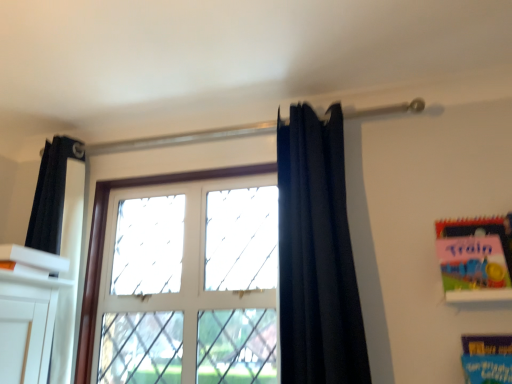
Identify the location of matte pink paper at upper right, positioned as the 1th paperback book in top-to-bottom order. (475, 258).

Describe the element at coordinates (487, 358) in the screenshot. This screenshot has height=384, width=512. I see `blue cardboard book at lower right, the second paperback book in the top-to-bottom sequence` at that location.

You are a GUI agent. You are given a task and a screenshot of the screen. Output one action in this format:
    pyautogui.click(x=<x>, y=<y>)
    Task: Click on the white glass window at center
    This screenshot has height=384, width=512.
    Given the screenshot: What is the action you would take?
    pyautogui.click(x=104, y=242)

Is dark blue fabric at center facing away from blue cardboard book at lower right, the second paperback book in the top-to-bottom sequence?

No.

Between dark blue fabric at center and blue cardboard book at lower right, marked as the first paperback book in a bottom-to-top arrangement, which one has larger size?

dark blue fabric at center is bigger.

Is dark blue fabric at center not close to blue cardboard book at lower right, marked as the first paperback book in a bottom-to-top arrangement?

dark blue fabric at center is near blue cardboard book at lower right, marked as the first paperback book in a bottom-to-top arrangement, not far away.

Considering the relative sizes of dark blue fabric at center and blue cardboard book at lower right, the second paperback book in the top-to-bottom sequence, in the image provided, is dark blue fabric at center taller than blue cardboard book at lower right, the second paperback book in the top-to-bottom sequence,?

Correct, dark blue fabric at center is much taller as blue cardboard book at lower right, the second paperback book in the top-to-bottom sequence.

From a real-world perspective, which is physically above, blue cardboard book at lower right, the second paperback book in the top-to-bottom sequence, or matte pink paper at upper right, the 2th paperback book when ordered from bottom to top?

matte pink paper at upper right, the 2th paperback book when ordered from bottom to top, from a real-world perspective.

What are the coordinates of `paperback book located above the blue cardboard book at lower right, the second paperback book in the top-to-bottom sequence (from a real-world perspective)` in the screenshot? It's located at (475, 258).

Is blue cardboard book at lower right, the second paperback book in the top-to-bottom sequence, wider or thinner than matte pink paper at upper right, the 2th paperback book when ordered from bottom to top?

In the image, blue cardboard book at lower right, the second paperback book in the top-to-bottom sequence, appears to be more narrow than matte pink paper at upper right, the 2th paperback book when ordered from bottom to top.

Is blue cardboard book at lower right, the second paperback book in the top-to-bottom sequence, to the right of matte pink paper at upper right, the 2th paperback book when ordered from bottom to top, from the viewer's perspective?

Incorrect, blue cardboard book at lower right, the second paperback book in the top-to-bottom sequence, is not on the right side of matte pink paper at upper right, the 2th paperback book when ordered from bottom to top.

In the image, is blue cardboard book at lower right, marked as the first paperback book in a bottom-to-top arrangement, on the left side or the right side of white glass window at center?

Based on their positions, blue cardboard book at lower right, marked as the first paperback book in a bottom-to-top arrangement, is located to the right of white glass window at center.

Is blue cardboard book at lower right, marked as the first paperback book in a bottom-to-top arrangement, shorter than white glass window at center?

Yes.

Is blue cardboard book at lower right, marked as the first paperback book in a bottom-to-top arrangement, touching white glass window at center?

No.

Find the location of `window that appears behind the blue cardboard book at lower right, the second paperback book in the top-to-bottom sequence`. window that appears behind the blue cardboard book at lower right, the second paperback book in the top-to-bottom sequence is located at coordinates (104, 242).

Is there a large distance between matte pink paper at upper right, the 2th paperback book when ordered from bottom to top, and blue cardboard book at lower right, the second paperback book in the top-to-bottom sequence?

No, there isn't a large distance between matte pink paper at upper right, the 2th paperback book when ordered from bottom to top, and blue cardboard book at lower right, the second paperback book in the top-to-bottom sequence.

Between point (439, 229) and point (502, 375), which one is positioned in front?

Positioned in front is point (502, 375).

Who is taller, matte pink paper at upper right, the 2th paperback book when ordered from bottom to top, or blue cardboard book at lower right, the second paperback book in the top-to-bottom sequence?

With more height is matte pink paper at upper right, the 2th paperback book when ordered from bottom to top.

Is matte pink paper at upper right, positioned as the 1th paperback book in top-to-bottom order, facing towards blue cardboard book at lower right, the second paperback book in the top-to-bottom sequence?

No, matte pink paper at upper right, positioned as the 1th paperback book in top-to-bottom order, does not turn towards blue cardboard book at lower right, the second paperback book in the top-to-bottom sequence.

Between white glass window at center and blue cardboard book at lower right, the second paperback book in the top-to-bottom sequence, which one has more height?

white glass window at center.

How different are the orientations of white glass window at center and blue cardboard book at lower right, the second paperback book in the top-to-bottom sequence, in degrees?

white glass window at center and blue cardboard book at lower right, the second paperback book in the top-to-bottom sequence, are facing 0.839 degrees away from each other.

Is white glass window at center next to blue cardboard book at lower right, the second paperback book in the top-to-bottom sequence?

They are not placed beside each other.

Based on the photo, from a real-world perspective, is dark blue fabric at center above or below white glass window at center?

dark blue fabric at center is situated higher than white glass window at center in the real world.

From the picture: From the image's perspective, which is above, dark blue fabric at center or white glass window at center?

Answer: dark blue fabric at center is shown above in the image.

Could you tell me if dark blue fabric at center is turned towards white glass window at center?

No, dark blue fabric at center is not turned towards white glass window at center.

From the picture: Which point is more distant from viewer, (286, 287) or (150, 184)?

Point (150, 184)

Does blue cardboard book at lower right, the second paperback book in the top-to-bottom sequence, have a lesser height compared to dark blue fabric at center?

Yes, blue cardboard book at lower right, the second paperback book in the top-to-bottom sequence, is shorter than dark blue fabric at center.

Between blue cardboard book at lower right, the second paperback book in the top-to-bottom sequence, and dark blue fabric at center, which one has larger width?

dark blue fabric at center.

Is blue cardboard book at lower right, the second paperback book in the top-to-bottom sequence, touching dark blue fabric at center?

blue cardboard book at lower right, the second paperback book in the top-to-bottom sequence, is not next to dark blue fabric at center, and they're not touching.

From a real-world perspective, is blue cardboard book at lower right, the second paperback book in the top-to-bottom sequence, on dark blue fabric at center?

Incorrect, from a real-world perspective, blue cardboard book at lower right, the second paperback book in the top-to-bottom sequence, is lower than dark blue fabric at center.

From the image's perspective, starting from the dark blue fabric at center, which paperback book is the 2nd one below? Please provide its 2D coordinates.

[(487, 358)]

Where is `paperback book on the right of blue cardboard book at lower right, marked as the first paperback book in a bottom-to-top arrangement`? Image resolution: width=512 pixels, height=384 pixels. paperback book on the right of blue cardboard book at lower right, marked as the first paperback book in a bottom-to-top arrangement is located at coordinates (475, 258).

Looking at the image, which one is located closer to white glass window at center, matte pink paper at upper right, the 2th paperback book when ordered from bottom to top, or dark blue fabric at center?

dark blue fabric at center is positioned closer to the anchor white glass window at center.

Looking at the image, which one is located further to dark blue fabric at center, matte pink paper at upper right, positioned as the 1th paperback book in top-to-bottom order, or white glass window at center?

white glass window at center is positioned further to the anchor dark blue fabric at center.

Which object lies further to the anchor point matte pink paper at upper right, the 2th paperback book when ordered from bottom to top, blue cardboard book at lower right, marked as the first paperback book in a bottom-to-top arrangement, or white glass window at center?

white glass window at center lies further to matte pink paper at upper right, the 2th paperback book when ordered from bottom to top, than the other object.

Looking at the image, which one is located further to dark blue fabric at center, matte pink paper at upper right, positioned as the 1th paperback book in top-to-bottom order, or blue cardboard book at lower right, the second paperback book in the top-to-bottom sequence?

blue cardboard book at lower right, the second paperback book in the top-to-bottom sequence, lies further to dark blue fabric at center than the other object.

From the image, which object appears to be farther from blue cardboard book at lower right, the second paperback book in the top-to-bottom sequence, white glass window at center or dark blue fabric at center?

white glass window at center.

When comparing their distances from white glass window at center, does blue cardboard book at lower right, marked as the first paperback book in a bottom-to-top arrangement, or matte pink paper at upper right, the 2th paperback book when ordered from bottom to top, seem closer?

matte pink paper at upper right, the 2th paperback book when ordered from bottom to top.

Based on their spatial positions, is matte pink paper at upper right, the 2th paperback book when ordered from bottom to top, or white glass window at center further from blue cardboard book at lower right, marked as the first paperback book in a bottom-to-top arrangement?

Based on the image, white glass window at center appears to be further to blue cardboard book at lower right, marked as the first paperback book in a bottom-to-top arrangement.

Based on their spatial positions, is dark blue fabric at center or white glass window at center further from matte pink paper at upper right, the 2th paperback book when ordered from bottom to top?

white glass window at center is further to matte pink paper at upper right, the 2th paperback book when ordered from bottom to top.

Identify the location of paperback book situated between white glass window at center and matte pink paper at upper right, the 2th paperback book when ordered from bottom to top, from left to right. This screenshot has height=384, width=512. (487, 358).

Image resolution: width=512 pixels, height=384 pixels. In order to click on paperback book between dark blue fabric at center and matte pink paper at upper right, the 2th paperback book when ordered from bottom to top, in the horizontal direction in this screenshot , I will do `click(487, 358)`.

Find the location of a particular element. This screenshot has height=384, width=512. curtain between white glass window at center and blue cardboard book at lower right, marked as the first paperback book in a bottom-to-top arrangement, in the horizontal direction is located at coordinates (317, 255).

Identify the location of curtain between white glass window at center and matte pink paper at upper right, positioned as the 1th paperback book in top-to-bottom order, from left to right. (317, 255).